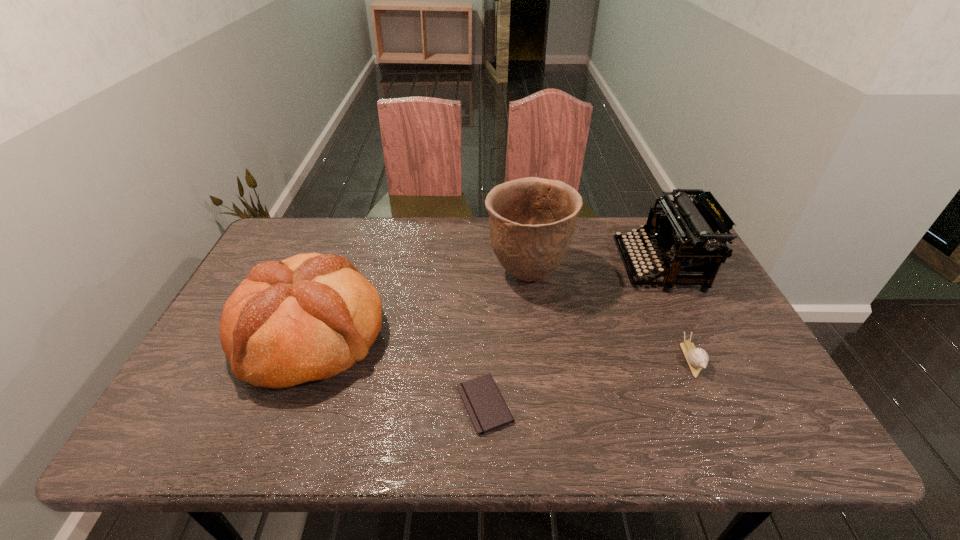
The height and width of the screenshot is (540, 960). In order to click on the tallest object in this screenshot , I will do `click(532, 220)`.

In order to click on typewriter in this screenshot , I will do `click(687, 236)`.

You are a GUI agent. You are given a task and a screenshot of the screen. Output one action in this format:
    pyautogui.click(x=<x>, y=<y>)
    Task: Click on the leftmost object
    The image size is (960, 540).
    Given the screenshot: What is the action you would take?
    pyautogui.click(x=309, y=317)

Identify the location of the fourth tallest object. Image resolution: width=960 pixels, height=540 pixels. (697, 358).

I want to click on the shortest object, so click(x=487, y=410).

You are a GUI agent. You are given a task and a screenshot of the screen. Output one action in this format:
    pyautogui.click(x=<x>, y=<y>)
    Task: Click on the free space located on the right of the tallest object
    This screenshot has height=540, width=960.
    Given the screenshot: What is the action you would take?
    pyautogui.click(x=612, y=275)

Find the location of a particular element. blank space located 0.390m on the typing side of the typewriter is located at coordinates (493, 266).

I want to click on vacant area situated 0.220m on the typing side of the typewriter, so click(549, 266).

Identify the location of vacant space situated 0.360m on the typing side of the typewriter. (503, 266).

The height and width of the screenshot is (540, 960). What are the coordinates of `vacant area situated on the back of the leftmost object` in the screenshot? It's located at (353, 224).